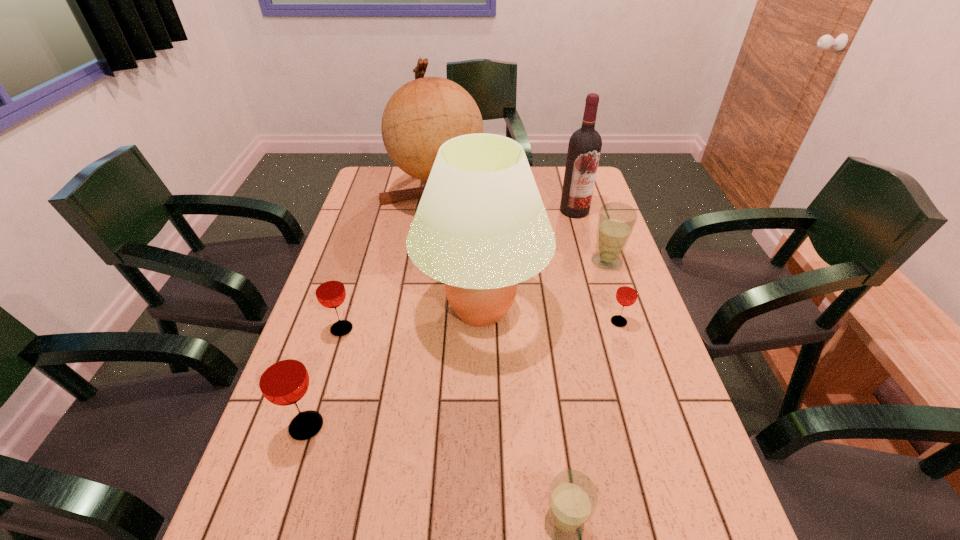
Find the location of a particular element. Image resolution: width=960 pixels, height=540 pixels. free space at the left edge of the desktop is located at coordinates (349, 248).

The width and height of the screenshot is (960, 540). I want to click on vacant region at the right edge of the desktop, so click(x=640, y=313).

At what (x,y) coordinates should I click in order to perform the action: click on blank region between the beige lampshade and the tallest glass. Please return your answer as a coordinate pair (x, y). Looking at the image, I should click on (394, 368).

You are a GUI agent. You are given a task and a screenshot of the screen. Output one action in this format:
    pyautogui.click(x=<x>, y=<y>)
    Task: Click on the free space between the farther blue glass and the fourth farthest glass
    
    Given the screenshot: What is the action you would take?
    pyautogui.click(x=457, y=344)

Where is `empty space between the smallest red glass and the right blue glass`? The image size is (960, 540). empty space between the smallest red glass and the right blue glass is located at coordinates (612, 292).

At what (x,y) coordinates should I click in order to perform the action: click on empty location between the second smallest red glass and the lampshade. Please return your answer as a coordinate pair (x, y). Looking at the image, I should click on (412, 319).

Where is `vacant space that's between the smallest red glass and the seventh farthest object`? This screenshot has width=960, height=540. vacant space that's between the smallest red glass and the seventh farthest object is located at coordinates [x=463, y=374].

Locate an element on the screen. Image resolution: width=960 pixels, height=540 pixels. object identified as the second closest to the smallest red glass is located at coordinates (616, 221).

The width and height of the screenshot is (960, 540). Identify the location of object that can be found as the fourth closest to the wine bottle. (627, 292).

Choose which glass is the nearest neighbor to the third glass from right to left. Please provide its 2D coordinates. Your answer should be formatted as a tuple, i.e. [(x, y)], where the tuple contains the x and y coordinates of a point satisfying the conditions above.

[(282, 377)]